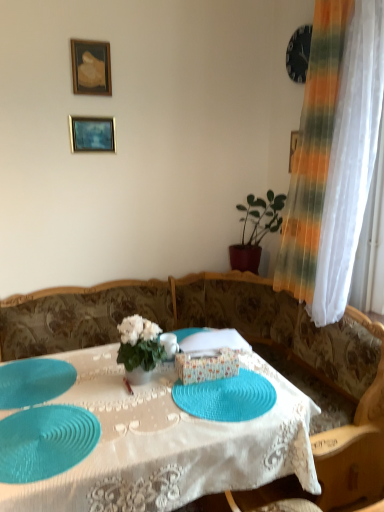
Locate an element on the screen. The height and width of the screenshot is (512, 384). unoccupied region to the right of teal rubber placemat at lower left, the second glass plate in the right-to-left sequence is located at coordinates (151, 425).